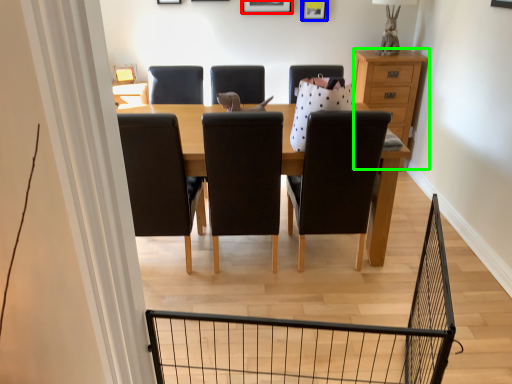
Question: Which is nearer to the picture frame (highlighted by a red box)? picture frame (highlighted by a blue box) or chest of drawers (highlighted by a green box).

Choices:
 (A) picture frame
 (B) chest of drawers

Answer: (A)